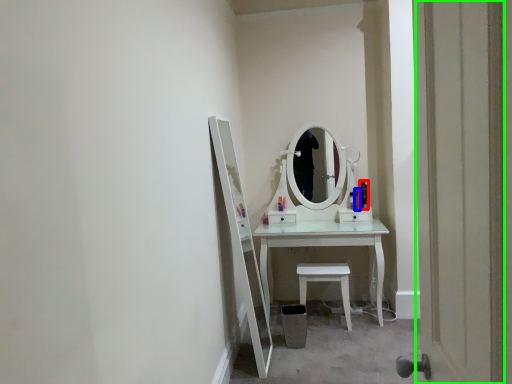
Question: Which object is the closest to the toiletry (highlighted by a red box)? Choose among these: toiletry (highlighted by a blue box) or door (highlighted by a green box).

Choices:
 (A) toiletry
 (B) door

Answer: (A)